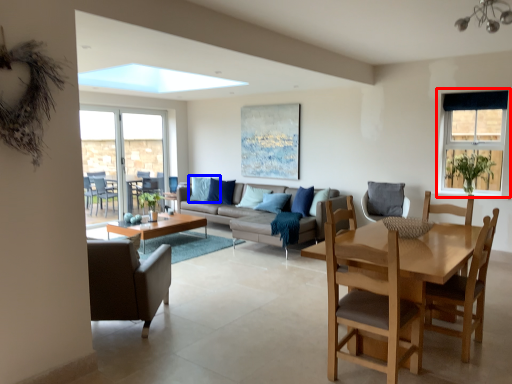
Question: Which point is closer to the camera, window (highlighted by a red box) or pillow (highlighted by a blue box)?

Choices:
 (A) window
 (B) pillow

Answer: (A)